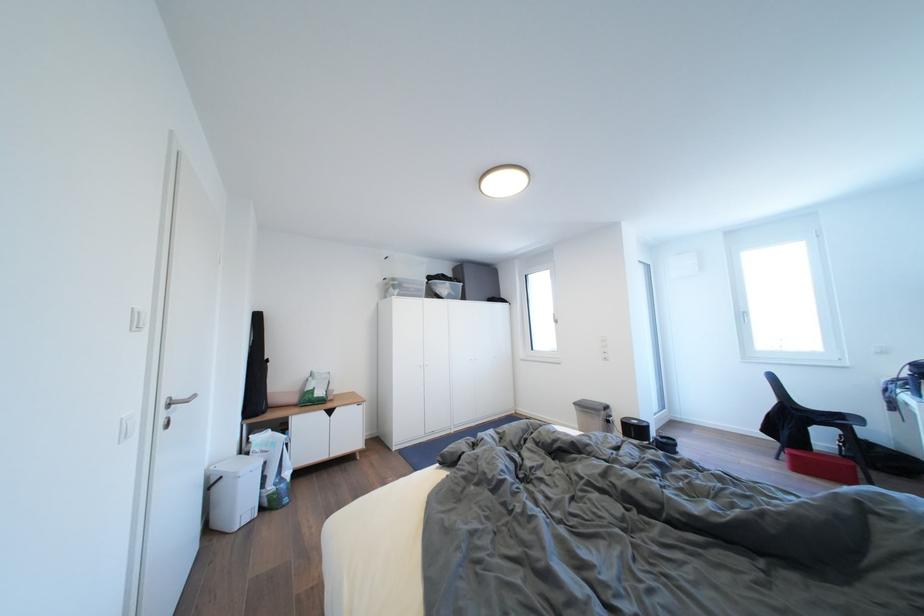
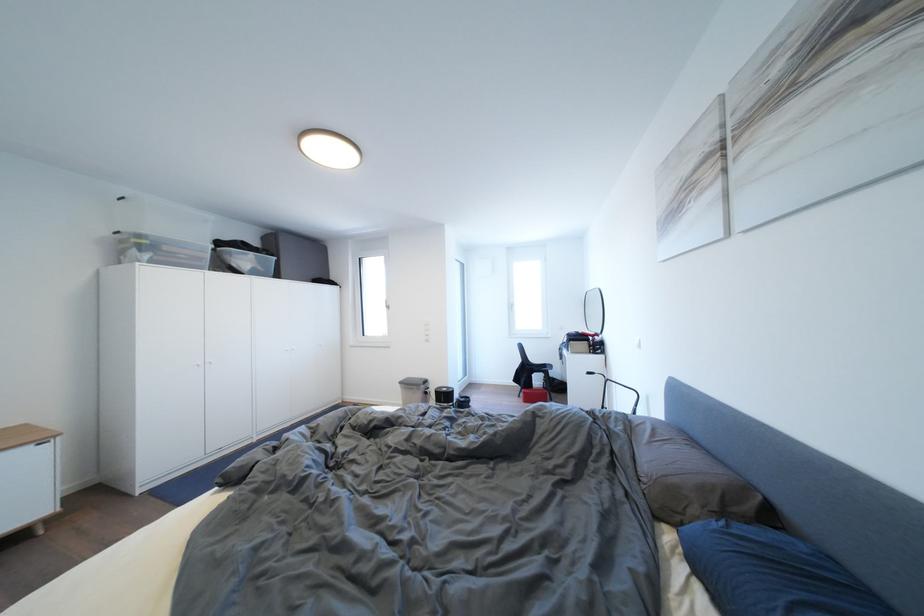
Where in the second image is the point corresponding to (x=444, y=290) from the first image?

(237, 259)